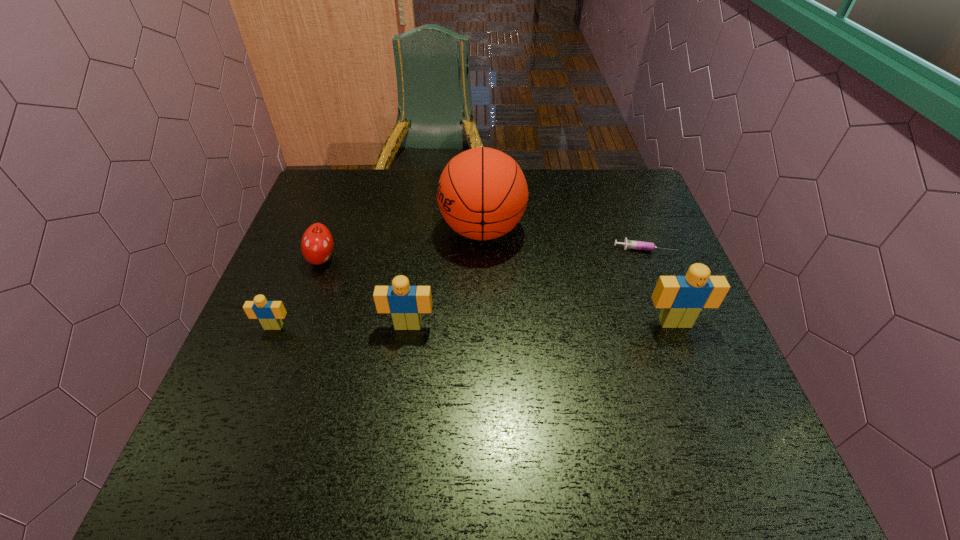
At what (x,y) coordinates should I click in order to perform the action: click on free spot located on the front of the syringe. Please return your answer as a coordinate pair (x, y). Looking at the image, I should click on 658,281.

At what (x,y) coordinates should I click in order to perform the action: click on vacant space situated on the side with logo of the tallest object. Please return your answer as a coordinate pair (x, y). This screenshot has width=960, height=540. Looking at the image, I should click on (350, 230).

Identify the location of vacant space located on the side with logo of the tallest object. This screenshot has width=960, height=540. (325, 230).

Image resolution: width=960 pixels, height=540 pixels. Identify the location of blank space located 0.060m on the side with logo of the tallest object. (419, 230).

This screenshot has height=540, width=960. In order to click on vacant space situated on the front of the apple in this screenshot , I will do `click(279, 377)`.

Where is `object that is at the far edge`? object that is at the far edge is located at coordinates (482, 193).

At what (x,y) coordinates should I click in order to perform the action: click on Lego at the left edge. Please return your answer as a coordinate pair (x, y). The height and width of the screenshot is (540, 960). Looking at the image, I should click on (269, 313).

Find the location of a particular element. apple that is at the left edge is located at coordinates (317, 244).

The width and height of the screenshot is (960, 540). I want to click on Lego that is at the right edge, so click(681, 298).

Identify the location of syringe at the right edge. (628, 244).